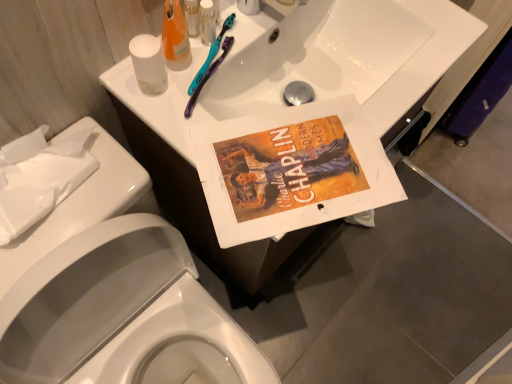
Question: Is clear plastic bottle at upper center, placed as the 1th toiletry when sorted from right to left, at the back of white glossy porcelain at upper center, which ranks as the 2th porcelain in back-to-front order?

Choices:
 (A) no
 (B) yes

Answer: (A)

Question: Can you confirm if white glossy porcelain at upper center, the first porcelain when ordered from front to back, is shorter than clear plastic bottle at upper center, which ranks as the second toiletry in left-to-right order?

Choices:
 (A) yes
 (B) no

Answer: (B)

Question: Is white glossy porcelain at upper center, which ranks as the 2th porcelain in back-to-front order, at the left side of clear plastic bottle at upper center, placed as the 1th toiletry when sorted from right to left?

Choices:
 (A) yes
 (B) no

Answer: (A)

Question: From a real-world perspective, is white glossy porcelain at upper center, the first porcelain when ordered from front to back, below clear plastic bottle at upper center, which ranks as the second toiletry in left-to-right order?

Choices:
 (A) no
 (B) yes

Answer: (B)

Question: Can you confirm if white glossy porcelain at upper center, which ranks as the 2th porcelain in back-to-front order, is smaller than clear plastic bottle at upper center, placed as the 1th toiletry when sorted from right to left?

Choices:
 (A) yes
 (B) no

Answer: (B)

Question: Is white glossy porcelain at upper center, the first porcelain when ordered from front to back, located outside clear plastic bottle at upper center, which ranks as the second toiletry in left-to-right order?

Choices:
 (A) no
 (B) yes

Answer: (B)

Question: From a real-world perspective, does white paper towel at left, marked as the 2th porcelain in a front-to-back arrangement, stand above translucent orange liquid at upper center?

Choices:
 (A) yes
 (B) no

Answer: (B)

Question: Would you say translucent orange liquid at upper center is part of white paper towel at left, marked as the 2th porcelain in a front-to-back arrangement,'s contents?

Choices:
 (A) yes
 (B) no

Answer: (B)

Question: Considering the relative sizes of white paper towel at left, marked as the 2th porcelain in a front-to-back arrangement, and translucent orange liquid at upper center in the image provided, is white paper towel at left, marked as the 2th porcelain in a front-to-back arrangement, smaller than translucent orange liquid at upper center?

Choices:
 (A) yes
 (B) no

Answer: (B)

Question: Does white paper towel at left, the 1th porcelain in the back-to-front sequence, lie in front of translucent orange liquid at upper center?

Choices:
 (A) no
 (B) yes

Answer: (B)

Question: Is white paper towel at left, the 1th porcelain in the back-to-front sequence, with translucent orange liquid at upper center?

Choices:
 (A) no
 (B) yes

Answer: (A)

Question: Does white paper towel at left, marked as the 2th porcelain in a front-to-back arrangement, appear on the right side of translucent orange liquid at upper center?

Choices:
 (A) yes
 (B) no

Answer: (B)

Question: Does white glossy porcelain at upper center, the first porcelain when ordered from front to back, come behind white paper towel at left, the 1th porcelain in the back-to-front sequence?

Choices:
 (A) yes
 (B) no

Answer: (B)